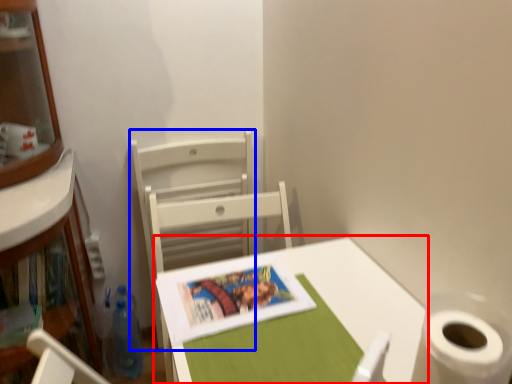
Question: Which object is closer to the camera taking this photo, table (highlighted by a red box) or chair (highlighted by a blue box)?

Choices:
 (A) table
 (B) chair

Answer: (A)